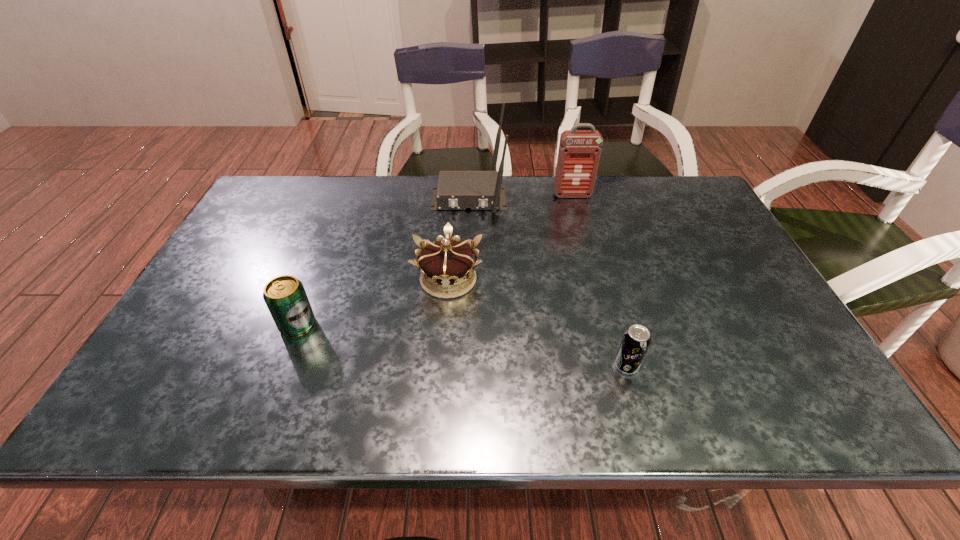
Locate an element on the screen. vacant position located 0.060m on the right of the nearest object is located at coordinates (667, 366).

The width and height of the screenshot is (960, 540). In order to click on router situated at the far edge in this screenshot , I will do `click(457, 190)`.

Find the location of a particular element. The image size is (960, 540). the first-aid kit at the far edge is located at coordinates (579, 152).

The width and height of the screenshot is (960, 540). In order to click on vacant space at the far edge in this screenshot , I will do `click(390, 181)`.

The image size is (960, 540). In the image, there is a desktop. What are the coordinates of `blank space at the near edge` in the screenshot? It's located at (256, 403).

The height and width of the screenshot is (540, 960). I want to click on vacant space at the left edge of the desktop, so click(x=170, y=337).

Identify the location of vacant space at the right edge of the desktop. This screenshot has width=960, height=540. (717, 219).

Locate an element on the screen. The image size is (960, 540). free space at the far right corner of the desktop is located at coordinates (670, 198).

Locate an element on the screen. The image size is (960, 540). free space between the beer can and the router is located at coordinates (383, 261).

The image size is (960, 540). I want to click on free spot between the soda can and the first-aid kit, so click(x=599, y=280).